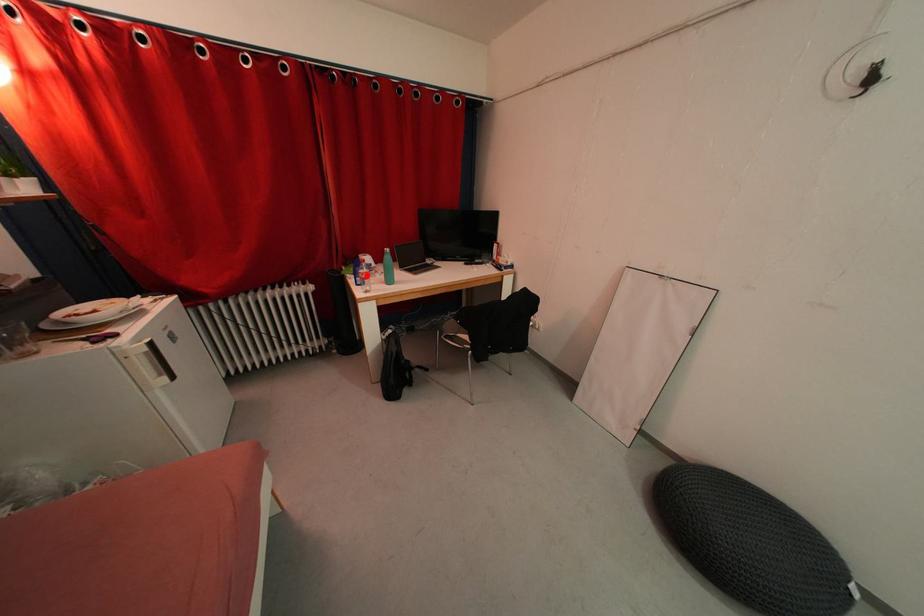
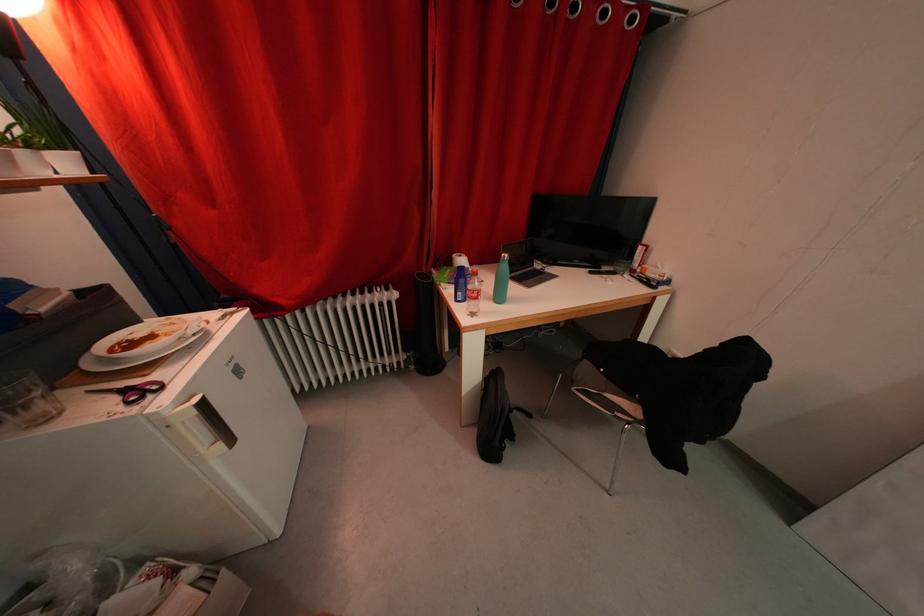
Question: I am providing you with two images of the same scene from different viewpoints. In image1, a red point is highlighted. Considering the same 3D point in image2, which of the following is correct?

Choices:
 (A) It is closer
 (B) It is farther

Answer: (B)